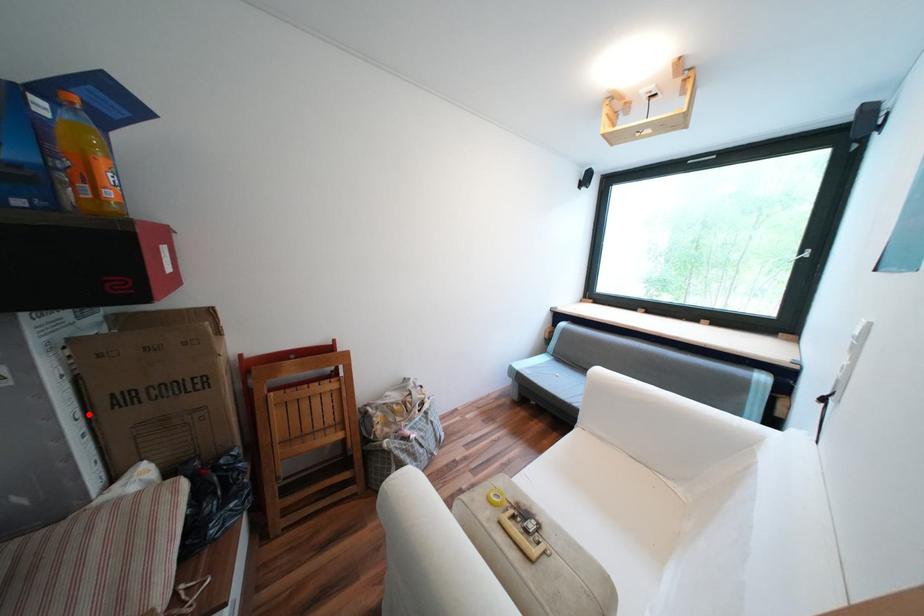
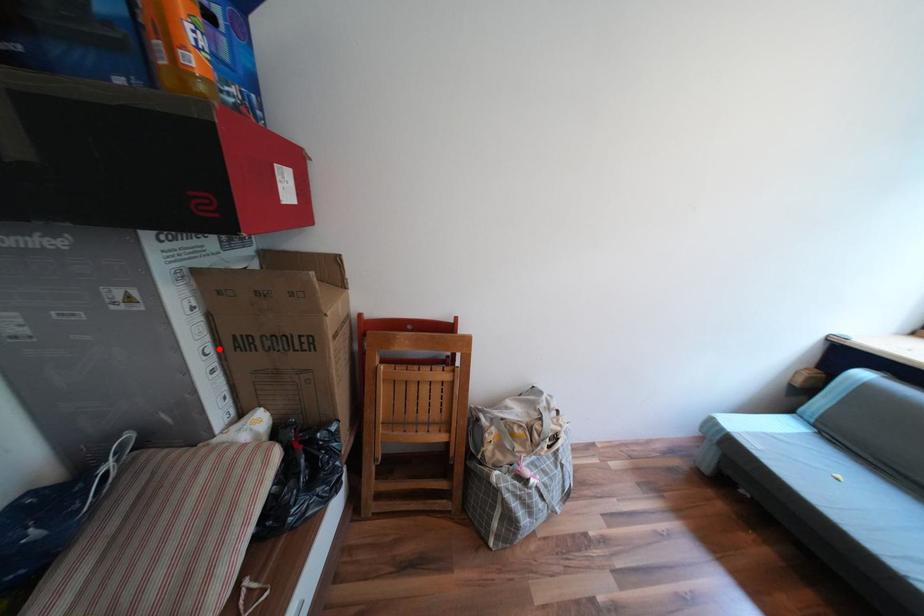
I am providing you with two images of the same scene from different viewpoints. A red point is marked on the first image and another point is marked on the second image. Is the red point in image1 aligned with the point shown in image2?

Yes